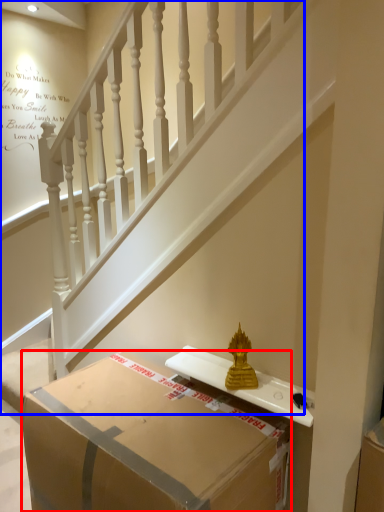
Question: Which object appears closest to the camera in this image, box (highlighted by a red box) or stairs (highlighted by a blue box)?

Choices:
 (A) box
 (B) stairs

Answer: (A)